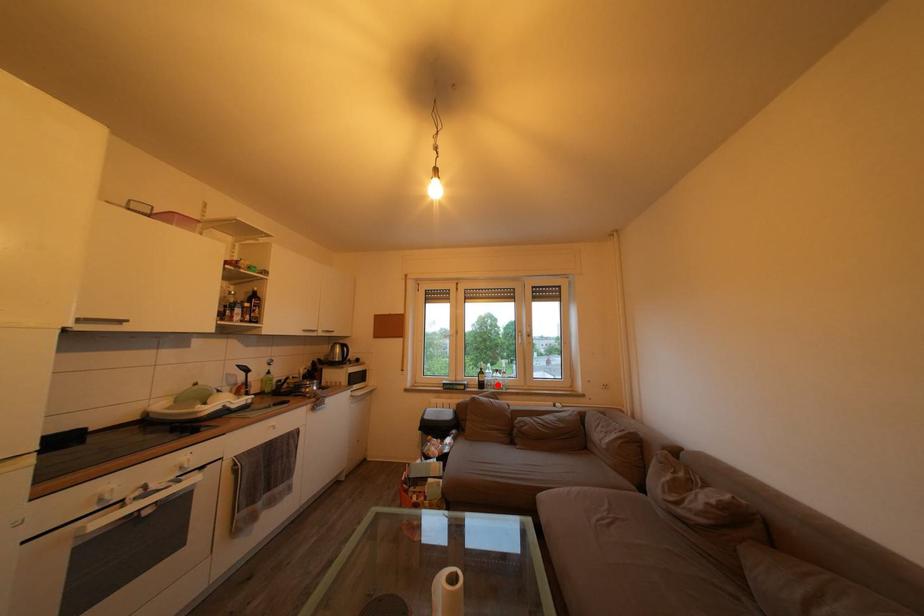
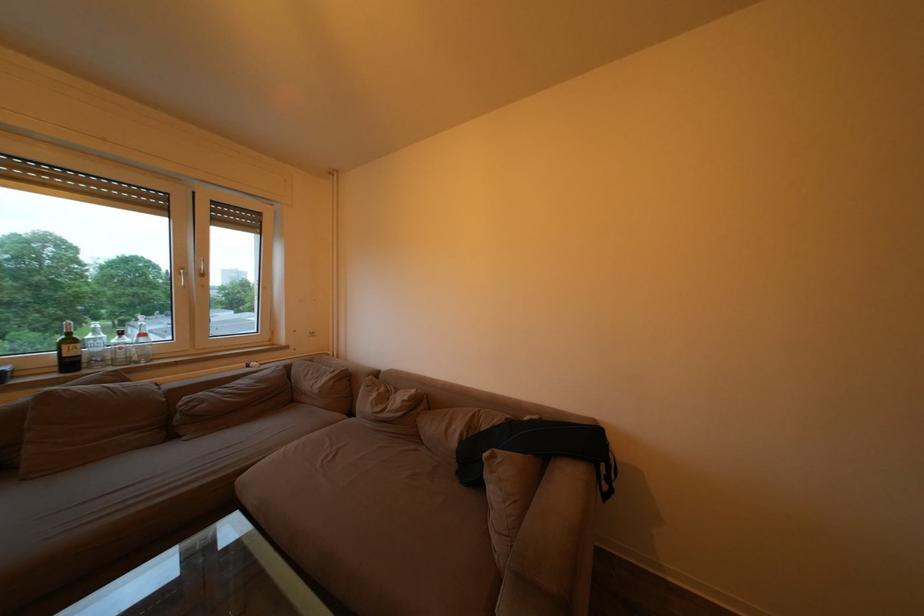
Where in the second image is the point corresponding to the highlighted location from the first image?

(107, 355)